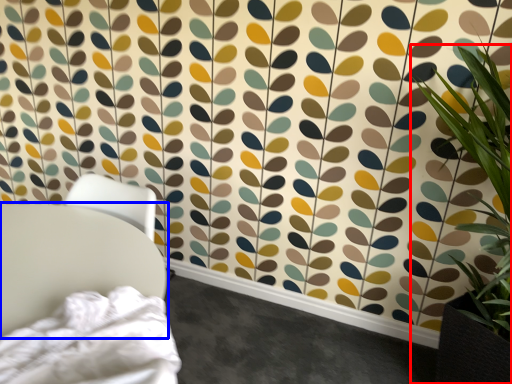
Question: Which object appears farthest to the camera in this image, houseplant (highlighted by a red box) or furniture (highlighted by a blue box)?

Choices:
 (A) houseplant
 (B) furniture

Answer: (B)